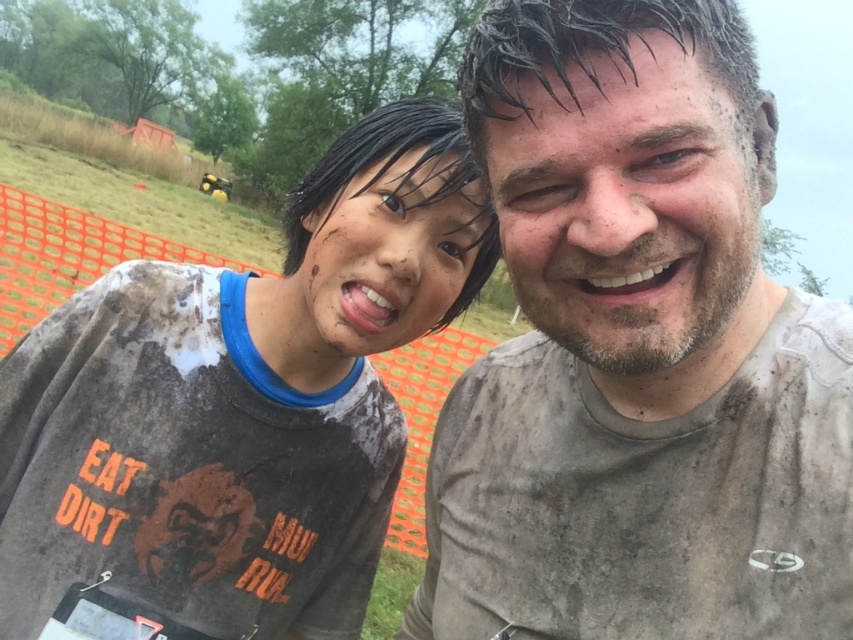
Question: Can you confirm if muddy gray shirt at center is wider than muddy t-shirt at left?

Choices:
 (A) no
 (B) yes

Answer: (A)

Question: Which of the following is the closest to the observer?

Choices:
 (A) muddy t-shirt at left
 (B) muddy gray shirt at center

Answer: (B)

Question: Does muddy gray shirt at center come behind muddy t-shirt at left?

Choices:
 (A) yes
 (B) no

Answer: (B)

Question: Which of the following is the closest to the observer?

Choices:
 (A) (370, 272)
 (B) (721, 481)

Answer: (B)

Question: Is muddy gray shirt at center positioned before muddy t-shirt at left?

Choices:
 (A) yes
 (B) no

Answer: (A)